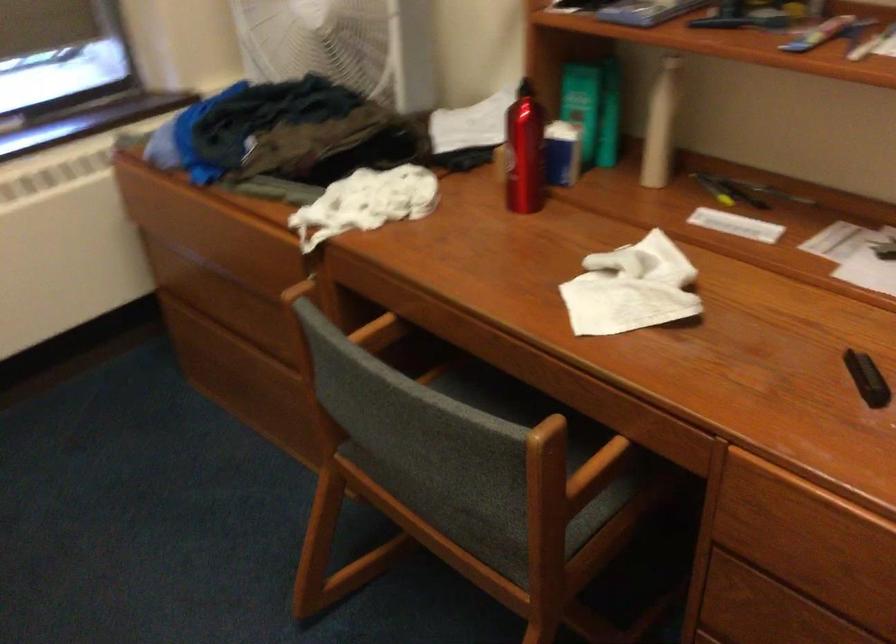
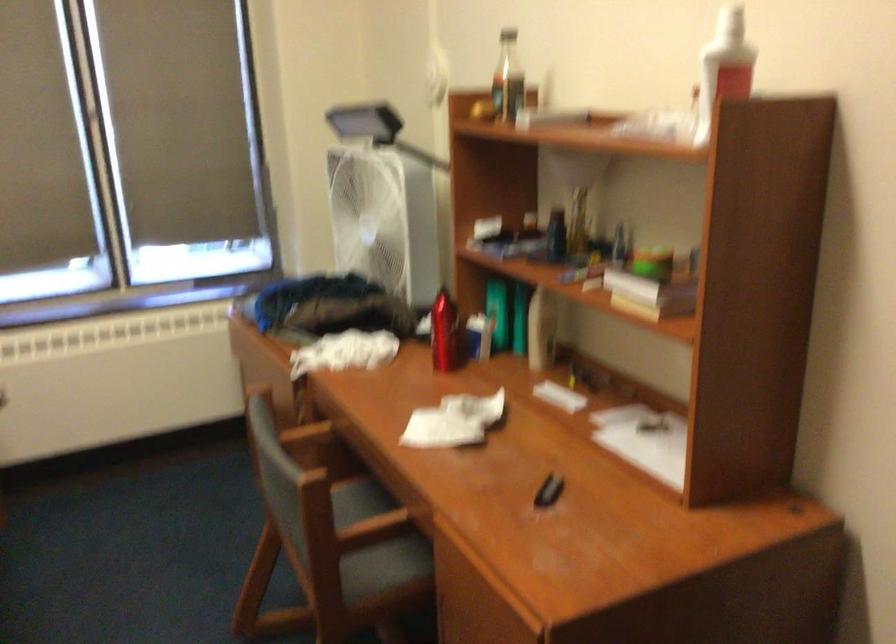
Question: The first image is from the beginning of the video and the second image is from the end. How did the camera likely rotate when shooting the video?

Choices:
 (A) Left
 (B) Right
 (C) Up
 (D) Down

Answer: (A)